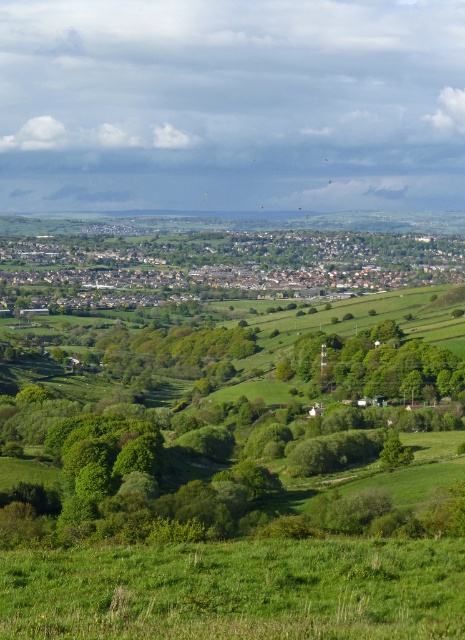
Which is above, green grassy field at lower center or green leafy tree at center?

green leafy tree at center is above.

Is point (186, 550) positioned behind point (411, 397)?

No, it is not.

Between point (58, 637) and point (305, 344), which one is positioned in front?

Positioned in front is point (58, 637).

The height and width of the screenshot is (640, 465). Find the location of `green grassy field at lower center`. green grassy field at lower center is located at coordinates (237, 589).

Does green grassy field at lower center have a lesser width compared to green leafy trees at center?

Indeed, green grassy field at lower center has a lesser width compared to green leafy trees at center.

Who is more distant from viewer, (113,573) or (181,339)?

Positioned behind is point (181,339).

The height and width of the screenshot is (640, 465). What do you see at coordinates (237, 589) in the screenshot?
I see `green grassy field at lower center` at bounding box center [237, 589].

Where is `green grassy field at lower center`? green grassy field at lower center is located at coordinates (237, 589).

Which is in front, point (270, 285) or point (187, 362)?

Positioned in front is point (187, 362).

Which is more to the right, green grassy field at center or green leafy trees at center?

Positioned to the right is green grassy field at center.

Which is in front, point (103, 276) or point (140, 342)?

Positioned in front is point (140, 342).

Identify the location of green grassy field at center. (218, 266).